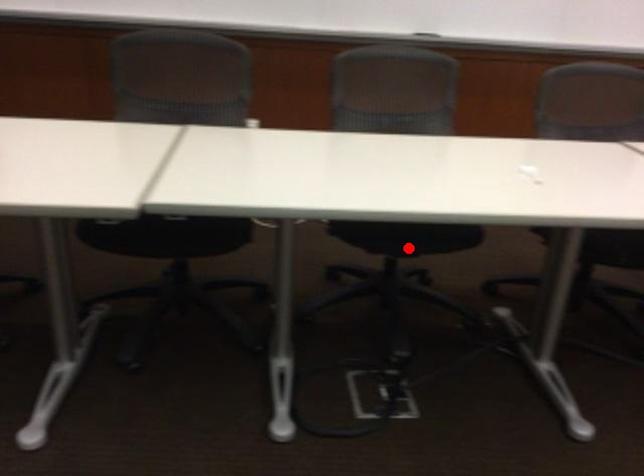
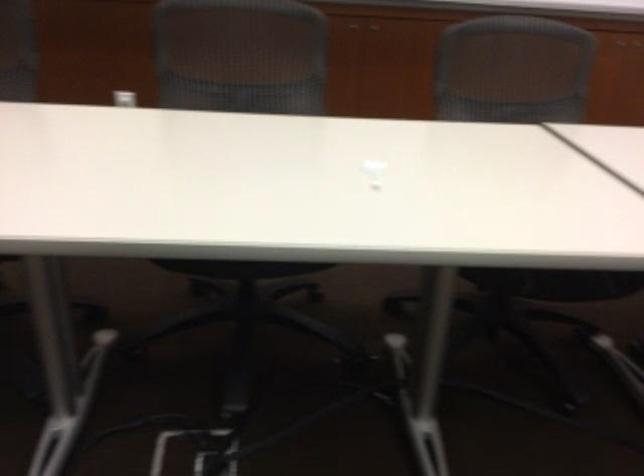
Question: I am providing you with two images of the same scene from different viewpoints. Image1 has a red point marked. In image2, the corresponding 3D location appears at what relative position? Reply with the corresponding letter.

Choices:
 (A) Closer
 (B) Farther

Answer: (A)